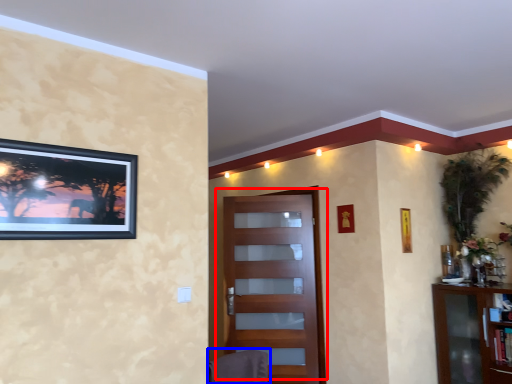
Question: Which of the following is the closest to the observer, door (highlighted by a red box) or swivel chair (highlighted by a blue box)?

Choices:
 (A) door
 (B) swivel chair

Answer: (B)